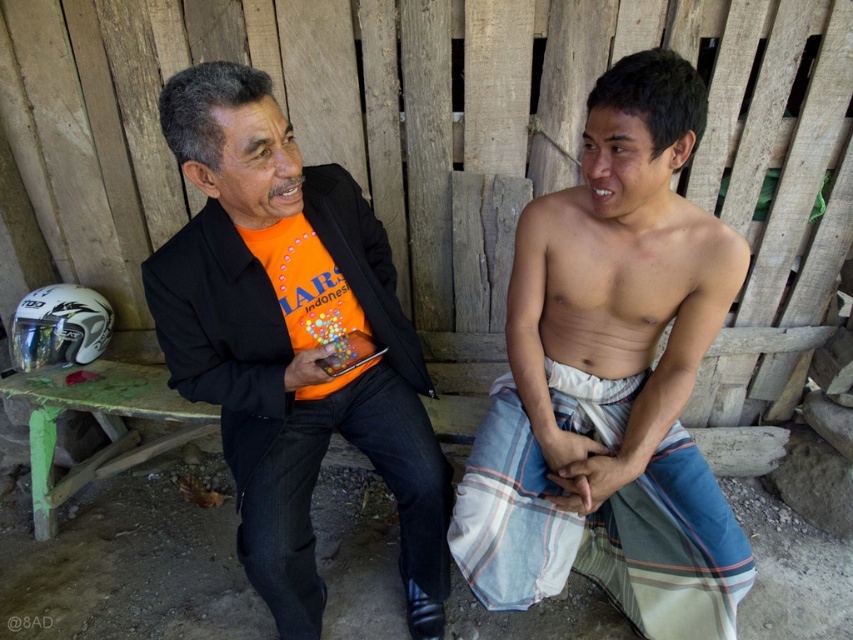
Question: Among these objects, which one is nearest to the camera?

Choices:
 (A) striped cotton sarong at lower center
 (B) orange matte shirt at center

Answer: (B)

Question: Can you confirm if striped cotton sarong at center is positioned below orange matte shirt at center?

Choices:
 (A) no
 (B) yes

Answer: (A)

Question: Which of the following is the closest to the observer?

Choices:
 (A) striped cotton sarong at center
 (B) striped cotton sarong at lower center
 (C) orange matte shirt at center

Answer: (C)

Question: Which point appears farthest from the camera in this image?

Choices:
 (A) (692, 472)
 (B) (489, 512)
 (C) (222, 436)

Answer: (C)

Question: Is striped cotton sarong at center positioned behind orange matte shirt at center?

Choices:
 (A) yes
 (B) no

Answer: (A)

Question: Can you confirm if striped cotton sarong at center is bigger than striped cotton sarong at lower center?

Choices:
 (A) yes
 (B) no

Answer: (A)